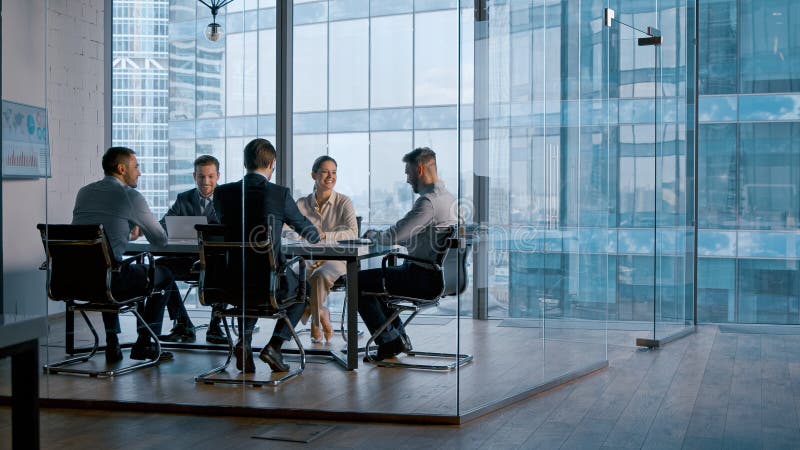
The width and height of the screenshot is (800, 450). Identify the location of glass panels of the wall. (670, 322), (582, 338), (512, 365), (136, 364), (20, 294).